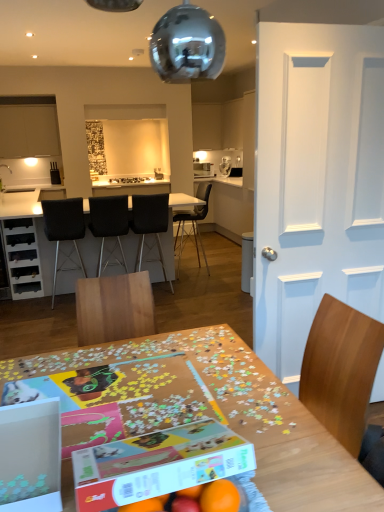
Question: Is white cardboard box at lower left, the 1th cardboard box in the left-to-right sequence, placed right next to black leather chair at center, arranged as the second chair when viewed from the left?

Choices:
 (A) no
 (B) yes

Answer: (A)

Question: From the image's perspective, is white cardboard box at lower left, the 1th cardboard box in the left-to-right sequence, beneath black leather chair at center, the third chair in the right-to-left sequence?

Choices:
 (A) yes
 (B) no

Answer: (A)

Question: Can you confirm if white cardboard box at lower left, the second cardboard box from the right, is wider than black leather chair at center, arranged as the second chair when viewed from the left?

Choices:
 (A) no
 (B) yes

Answer: (A)

Question: Is black leather chair at center, the third chair in the right-to-left sequence, at the back of white cardboard box at lower left, the 1th cardboard box in the left-to-right sequence?

Choices:
 (A) yes
 (B) no

Answer: (B)

Question: Does white cardboard box at lower left, the 1th cardboard box in the left-to-right sequence, lie in front of black leather chair at center, arranged as the second chair when viewed from the left?

Choices:
 (A) no
 (B) yes

Answer: (B)

Question: From the image's perspective, is white cardboard box at lower left, the 1th cardboard box in the left-to-right sequence, on top of black leather chair at center, arranged as the second chair when viewed from the left?

Choices:
 (A) no
 (B) yes

Answer: (A)

Question: Is wooden puzzle table at center, marked as the second table in a top-to-bottom arrangement, with black matte chair at center, the fourth chair positioned from the left?

Choices:
 (A) yes
 (B) no

Answer: (B)

Question: Is wooden puzzle table at center, marked as the first table in a front-to-back arrangement, oriented away from black matte chair at center, the fourth chair positioned from the left?

Choices:
 (A) yes
 (B) no

Answer: (B)

Question: Is wooden puzzle table at center, marked as the first table in a front-to-back arrangement, bigger than black matte chair at center, the fourth chair positioned from the left?

Choices:
 (A) yes
 (B) no

Answer: (A)

Question: Is wooden puzzle table at center, arranged as the 2th table when viewed from the back, behind black matte chair at center, which is the 1th chair in right-to-left order?

Choices:
 (A) no
 (B) yes

Answer: (A)

Question: Can you confirm if wooden puzzle table at center, marked as the second table in a top-to-bottom arrangement, is taller than black matte chair at center, which is the 1th chair in right-to-left order?

Choices:
 (A) no
 (B) yes

Answer: (A)

Question: Considering the relative sizes of wooden puzzle table at center, the first table ordered from the bottom, and black matte chair at center, which is the 1th chair in right-to-left order, in the image provided, is wooden puzzle table at center, the first table ordered from the bottom, wider than black matte chair at center, which is the 1th chair in right-to-left order,?

Choices:
 (A) no
 (B) yes

Answer: (B)

Question: Can you confirm if white cardboard box at center, placed as the 2th cardboard box when sorted from left to right, is taller than white glossy table at center, which ranks as the second table in bottom-to-top order?

Choices:
 (A) yes
 (B) no

Answer: (B)